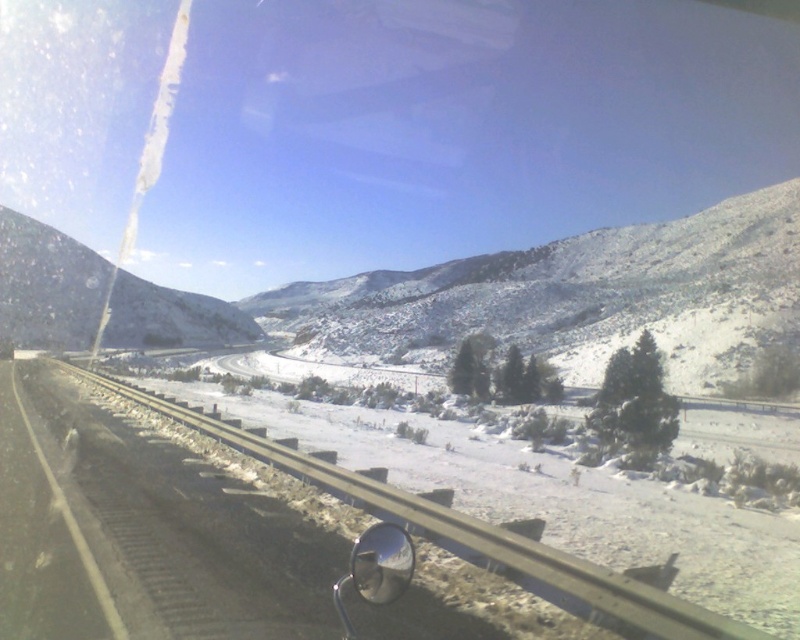
Consider the image. You are driving a car and notice the snowy rocky mountain at left and the glossy metallic view mirror at lower center. Which object is closer to you from your current position inside the vehicle?

The glossy metallic view mirror at lower center is closer to you because it is positioned under the snowy rocky mountain at left, indicating it is in front of the mountain from your viewpoint.

You are driving a car and want to check the snowy rocky mountain at left while adjusting the glossy metallic view mirror at lower center. Which object will you look at first?

You will look at the snowy rocky mountain at left first because it is closer to you than the glossy metallic view mirror at lower center.

You are a hiker planning to climb the snowy rocky mountain at center and the snowy rocky mountain at left. Based on the scene, which mountain would require more stamina due to its height?

The snowy rocky mountain at center is much taller than the snowy rocky mountain at left, so it would require more stamina to climb.